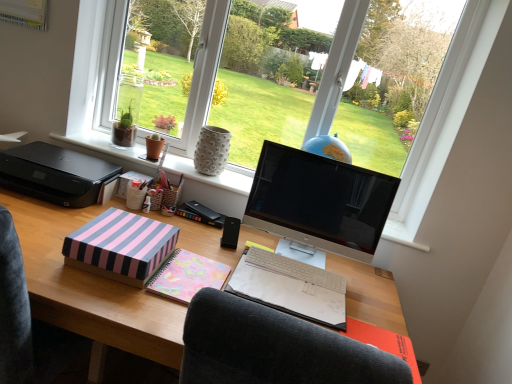
Find the location of a particular element. This screenshot has height=384, width=512. blank space situated above pastel floral notebook at center (from a real-world perspective) is located at coordinates (306, 283).